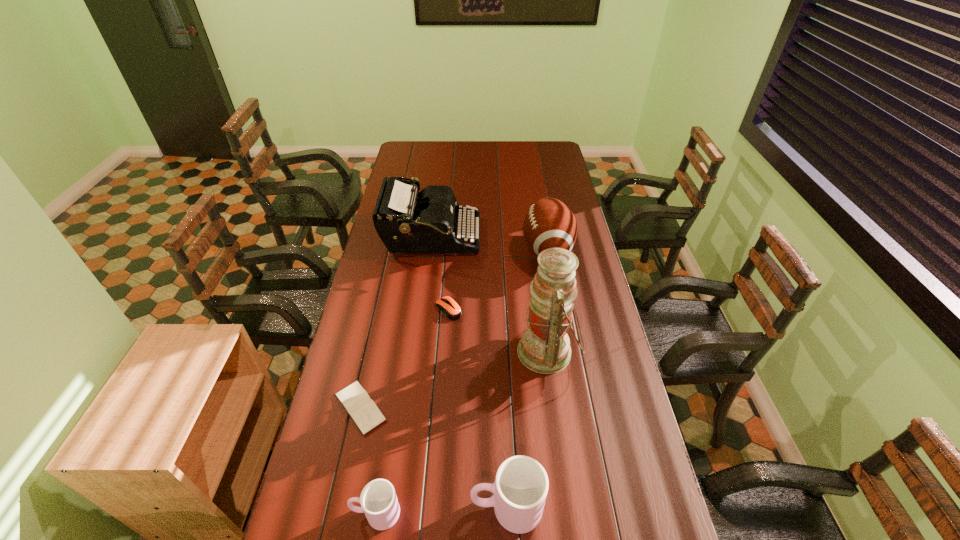
Identify the location of vacant region that satisfies the following two spatial constraints: 1. on the laces of the football; 2. on the front side of the tallest object. Image resolution: width=960 pixels, height=540 pixels. (565, 352).

At what (x,y) coordinates should I click in order to perform the action: click on free point that satisfies the following two spatial constraints: 1. on the back side of the oil lamp; 2. on the left side of the diary. Please return your answer as a coordinate pair (x, y). Image resolution: width=960 pixels, height=540 pixels. Looking at the image, I should click on (372, 352).

At what (x,y) coordinates should I click in order to perform the action: click on vacant position in the image that satisfies the following two spatial constraints: 1. on the typing side of the typewriter; 2. with the handle on the side of the right cup. Please return your answer as a coordinate pair (x, y). Looking at the image, I should click on (396, 508).